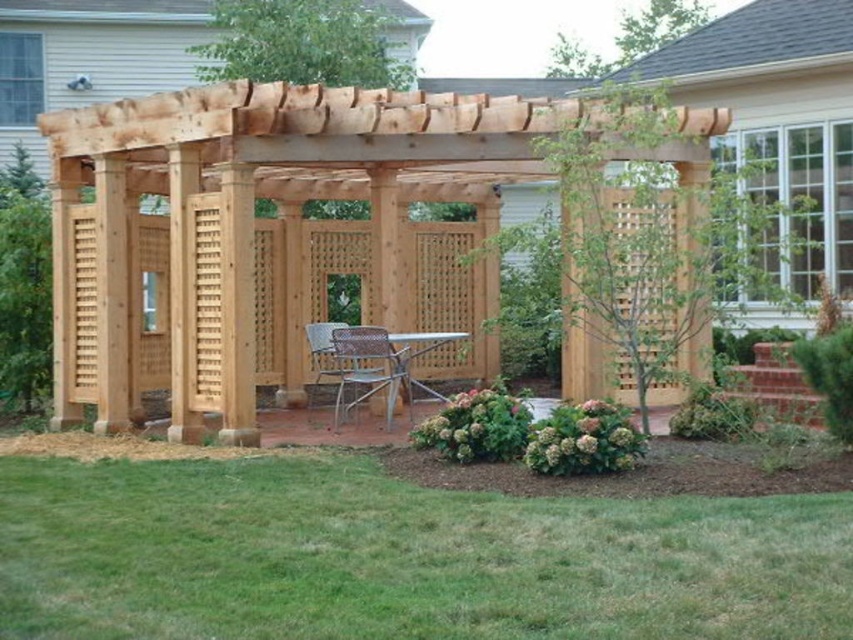
Between green grass at lower center and rattan chair at center, which one is positioned lower?

green grass at lower center

Who is higher up, green grass at lower center or rattan chair at center?

rattan chair at center is above.

You are a GUI agent. You are given a task and a screenshot of the screen. Output one action in this format:
    pyautogui.click(x=<x>, y=<y>)
    Task: Click on the green grass at lower center
    
    Given the screenshot: What is the action you would take?
    pyautogui.click(x=401, y=557)

Is rattan chair at center to the left of metallic silver chair at center from the viewer's perspective?

No, rattan chair at center is not to the left of metallic silver chair at center.

Does rattan chair at center come behind metallic silver chair at center?

No.

Is point (392, 394) positioned after point (352, 326)?

No, it is not.

Image resolution: width=853 pixels, height=640 pixels. Find the location of `rattan chair at center`. rattan chair at center is located at coordinates (367, 368).

Can you confirm if natural wood pergola at center is thinner than rattan chair at center?

Correct, natural wood pergola at center's width is less than rattan chair at center's.

Consider the image. Measure the distance between point (x=415, y=188) and camera.

Point (x=415, y=188) and camera are 15.21 meters apart.

Where is `natural wood pergola at center`? natural wood pergola at center is located at coordinates (262, 232).